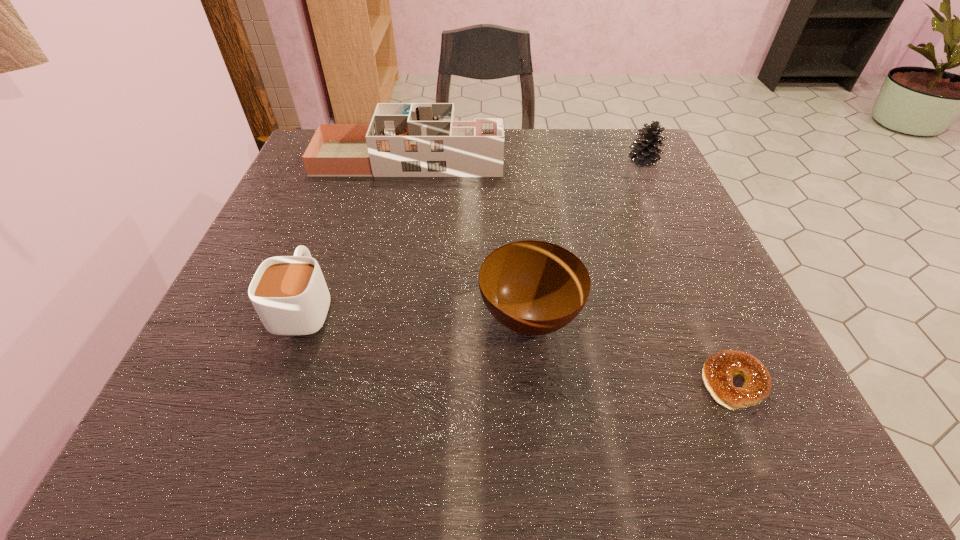
You are a GUI agent. You are given a task and a screenshot of the screen. Output one action in this format:
    pyautogui.click(x=<x>, y=<y>)
    Task: Click on the pinecone
    Image resolution: width=960 pixels, height=540 pixels.
    Given the screenshot: What is the action you would take?
    pyautogui.click(x=645, y=152)

At what (x,y) coordinates should I click in order to perform the action: click on dollhouse. Please return your answer as a coordinate pair (x, y). This screenshot has height=540, width=960. Looking at the image, I should click on (403, 139).

Locate an element on the screen. The width and height of the screenshot is (960, 540). bowl is located at coordinates (531, 287).

Locate an element on the screen. The height and width of the screenshot is (540, 960). cup is located at coordinates (289, 293).

Image resolution: width=960 pixels, height=540 pixels. In order to click on the shortest object in this screenshot , I will do `click(719, 369)`.

Where is `vacant space located 0.340m on the left of the pinecone`? The image size is (960, 540). vacant space located 0.340m on the left of the pinecone is located at coordinates (479, 161).

The image size is (960, 540). Find the location of `blank space located 0.100m at the entrance of the dollhouse`. blank space located 0.100m at the entrance of the dollhouse is located at coordinates (544, 158).

Find the location of a particular element. vacant point located on the back of the bowl is located at coordinates (519, 212).

Locate an element on the screen. This screenshot has width=960, height=540. free spot located 0.120m on the side with the handle of the cup is located at coordinates click(332, 230).

This screenshot has height=540, width=960. What are the coordinates of `vacant space located 0.350m on the side with the handle of the cup` in the screenshot? It's located at (355, 165).